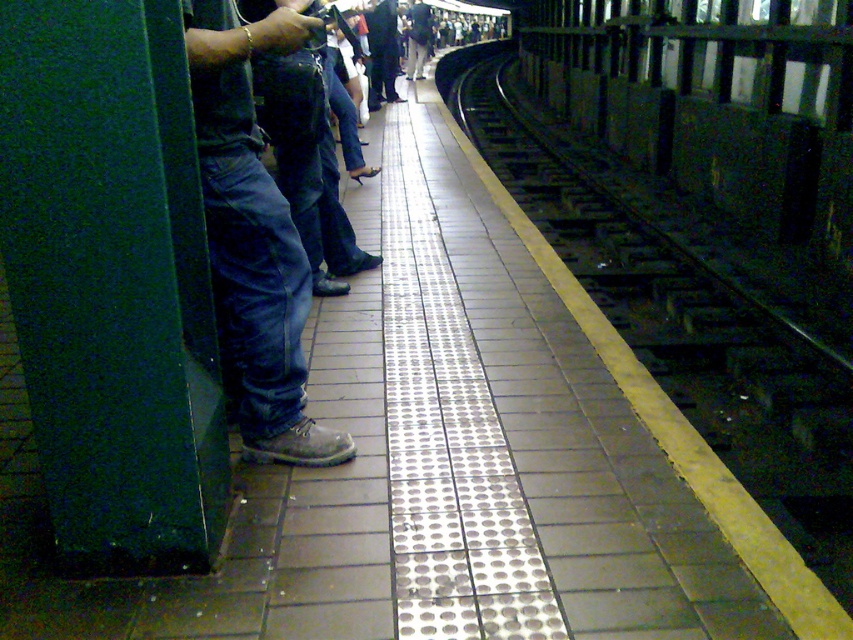
Does denim jeans at left appear on the right side of dark blue jeans at center?

Yes, denim jeans at left is to the right of dark blue jeans at center.

Can you confirm if denim jeans at left is taller than dark blue jeans at center?

No.

Between point (293, 371) and point (392, 20), which one is positioned in front?

Point (293, 371) is in front.

You are a GUI agent. You are given a task and a screenshot of the screen. Output one action in this format:
    pyautogui.click(x=<x>, y=<y>)
    Task: Click on the denim jeans at left
    
    Given the screenshot: What is the action you would take?
    pyautogui.click(x=253, y=236)

Is point (727, 404) positioned in front of point (222, 202)?

No, it is behind (222, 202).

Is point (495, 80) farther from viewer compared to point (271, 36)?

Yes.

The height and width of the screenshot is (640, 853). Identify the location of metal/textured train track at right. (677, 312).

Which is above, metal/textured train track at right or dark blue jeans at center?

dark blue jeans at center

Does metal/textured train track at right come in front of dark blue jeans at center?

Yes, it is in front of dark blue jeans at center.

Identify the location of metal/textured train track at right. The height and width of the screenshot is (640, 853). (677, 312).